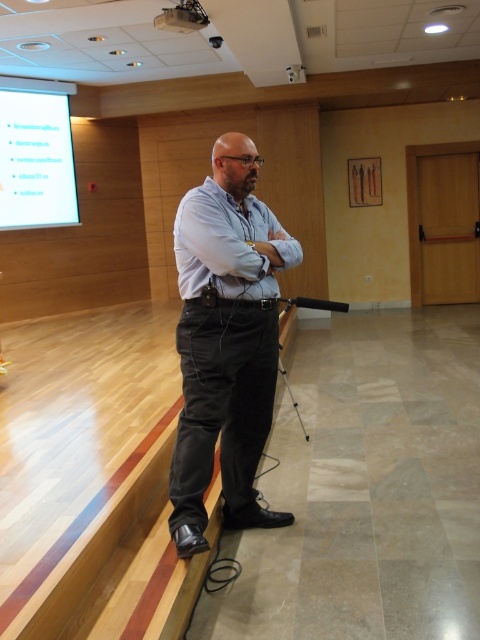
Consider the image. You are an event organizer setting up chairs for an audience. You need to ensure that the dark gray corduroy pants at center and the white glossy projection screen at upper left are visible to everyone. Based on their heights, which object would likely block the view of the other if someone sits in the front row?

The dark gray corduroy pants at center is much taller than the white glossy projection screen at upper left, so the dark gray corduroy pants at center would block the view of the white glossy projection screen at upper left for someone sitting in the front row.

You are an interior designer planning to place a new rug in the conference room. The rug must accommodate both the dark gray corduroy pants at center and the white plastic projector at upper center. Considering their sizes, which object requires more space on the rug?

The dark gray corduroy pants at center requires more space on the rug because it has a larger size compared to the white plastic projector at upper center.

You are setting up a presentation and need to ensure that the white glossy projection screen at upper left and the white plastic projector at upper center are positioned correctly. Based on their heights, which one should be placed higher to align the projection properly?

The white glossy projection screen at upper left should be placed higher than the white plastic projector at upper center since it has a greater height, allowing the projection to align properly.